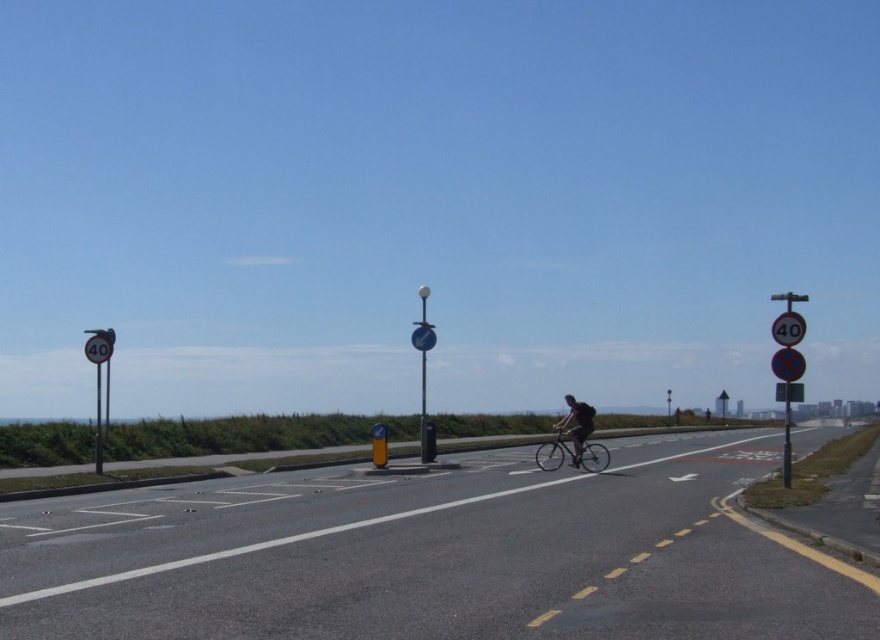
You are a delivery drone flying above the road and need to land on the asphalt road at center. The coordinates for landing must be within a 0.05 unit radius of point (435, 557). Is this landing spot available?

The asphalt road at center is located at point (435, 557), so the drone can land there as the coordinates are within the required radius.

From the picture: You are a delivery person needing to choose between the shiny metallic bicycle at center and the metallic silver bicycle at center for a trip that requires carrying heavy packages. Which bicycle would be more suitable based on their widths?

The metallic silver bicycle at center has a greater width than the shiny metallic bicycle at center, making it more suitable for carrying heavy packages as wider bicycles typically provide better stability.